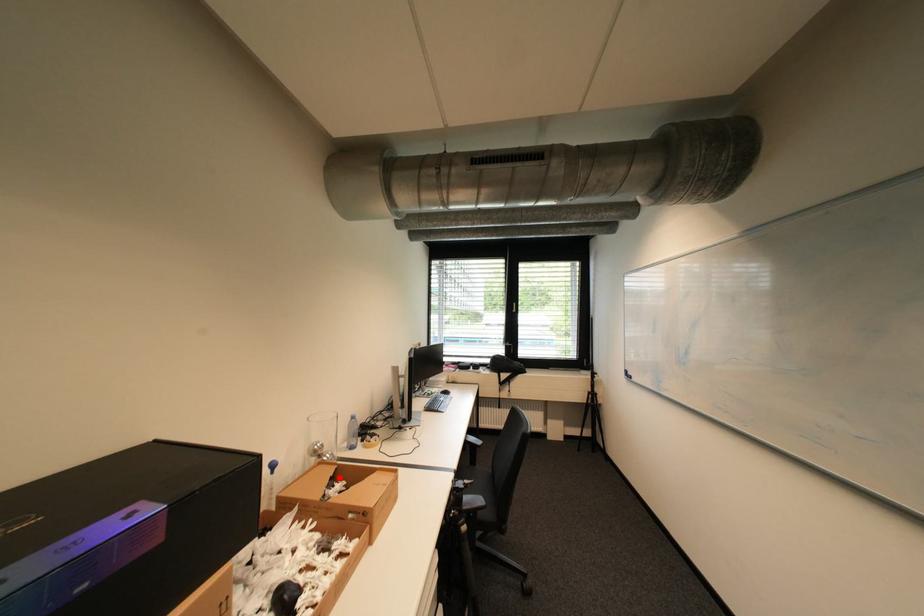
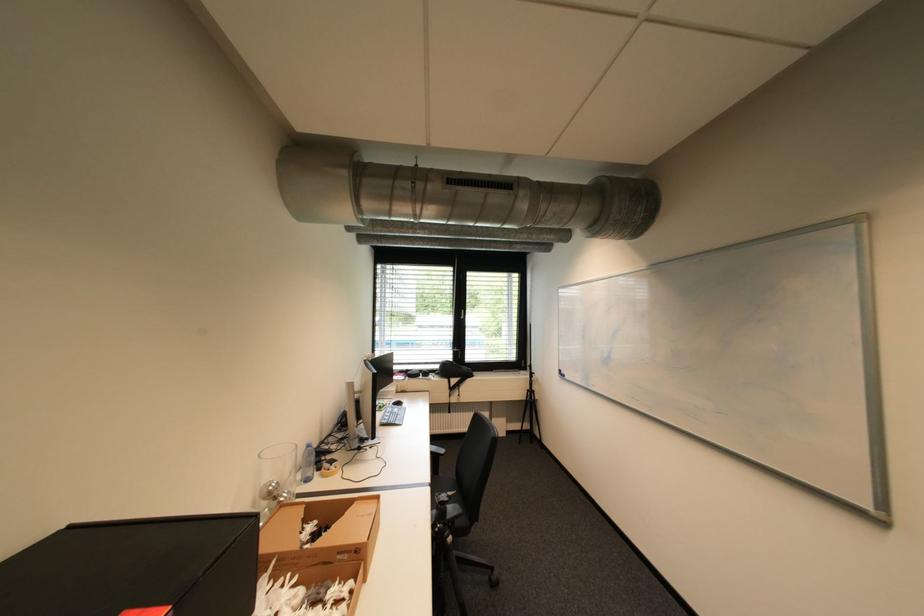
Question: I am providing you with two images of the same scene from different viewpoints. A red point is shown in image1. For the corresponding object point in image2, is it positioned nearer or farther from the camera?

Choices:
 (A) Nearer
 (B) Farther

Answer: (B)